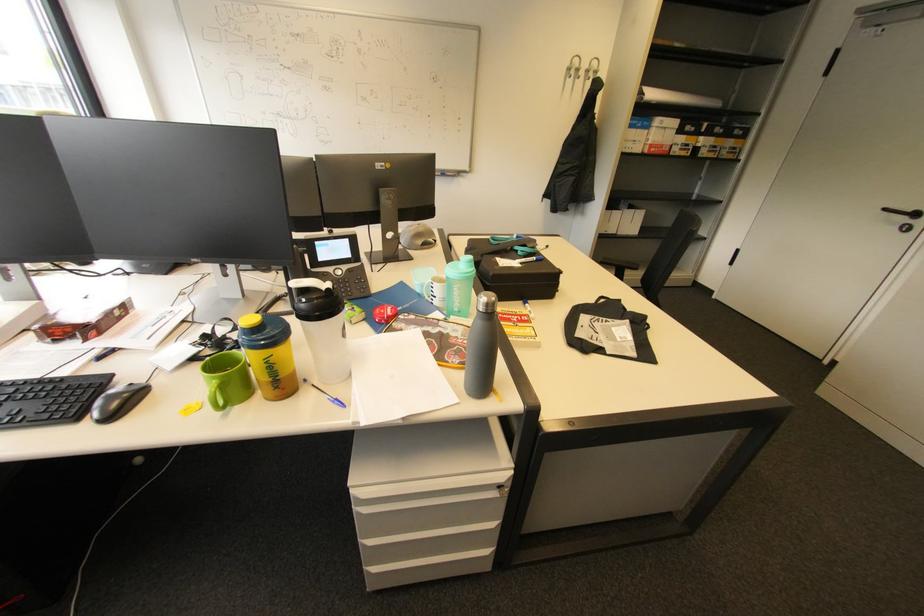
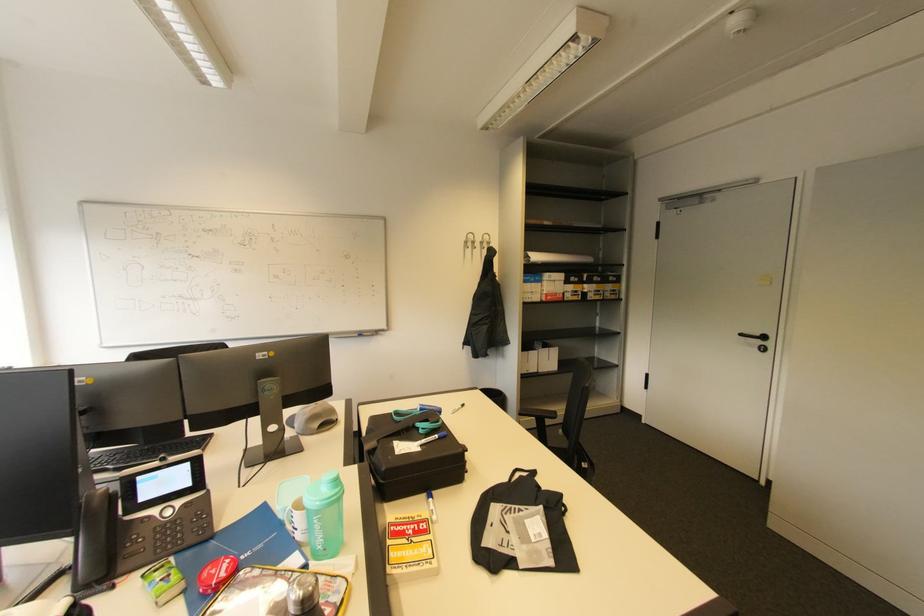
Question: The images are taken continuously from a first-person perspective. In which direction is your viewpoint rotating?

Choices:
 (A) Left
 (B) Right
 (C) Up
 (D) Down

Answer: (C)